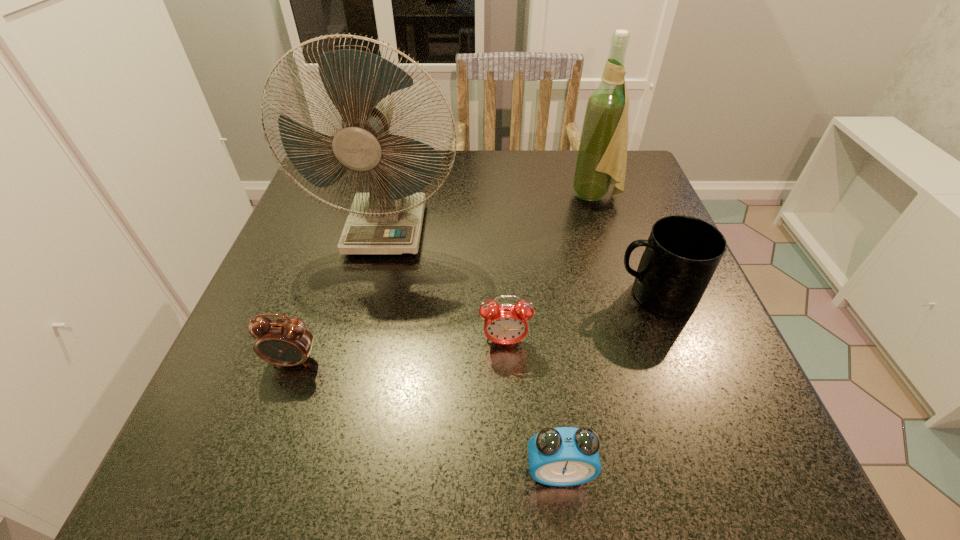
You are a GUI agent. You are given a task and a screenshot of the screen. Output one action in this format:
    pyautogui.click(x=<x>, y=<y>)
    Task: Click on the object that can be found as the fourth closest to the nearest alarm clock
    The height and width of the screenshot is (540, 960).
    Given the screenshot: What is the action you would take?
    pyautogui.click(x=388, y=220)

Choose which alarm clock is the second nearest neighbor to the wine bottle. Please provide its 2D coordinates. Your answer should be formatted as a tuple, i.e. [(x, y)], where the tuple contains the x and y coordinates of a point satisfying the conditions above.

[(563, 456)]

At what (x,y) coordinates should I click in order to perform the action: click on the closest alarm clock to the wine bottle. Please return your answer as a coordinate pair (x, y). Looking at the image, I should click on (506, 323).

Find the location of a particular element. This screenshot has width=960, height=540. vacant space that satisfies the following two spatial constraints: 1. on the front-facing side of the wine bottle; 2. on the front-facing side of the fan is located at coordinates [x=606, y=230].

Locate an element on the screen. The width and height of the screenshot is (960, 540). free space that satisfies the following two spatial constraints: 1. on the front-facing side of the wine bottle; 2. on the face of the nearest object is located at coordinates (684, 471).